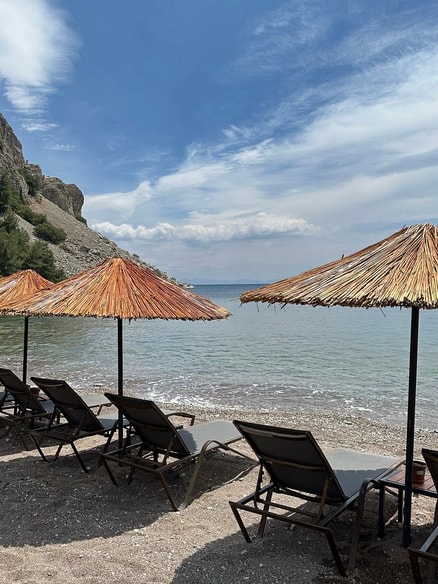
Locate an element on the screen. side table is located at coordinates (391, 478).